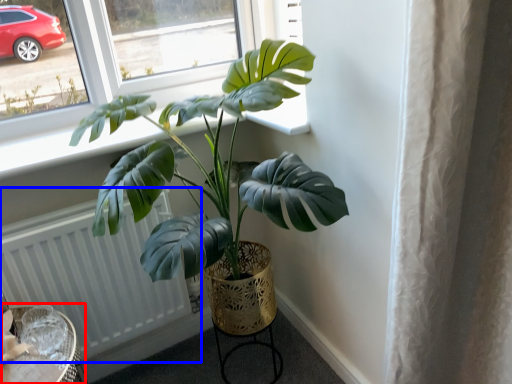
Question: Which object appears closest to the camera in this image, round table (highlighted by a red box) or radiator (highlighted by a blue box)?

Choices:
 (A) round table
 (B) radiator

Answer: (A)